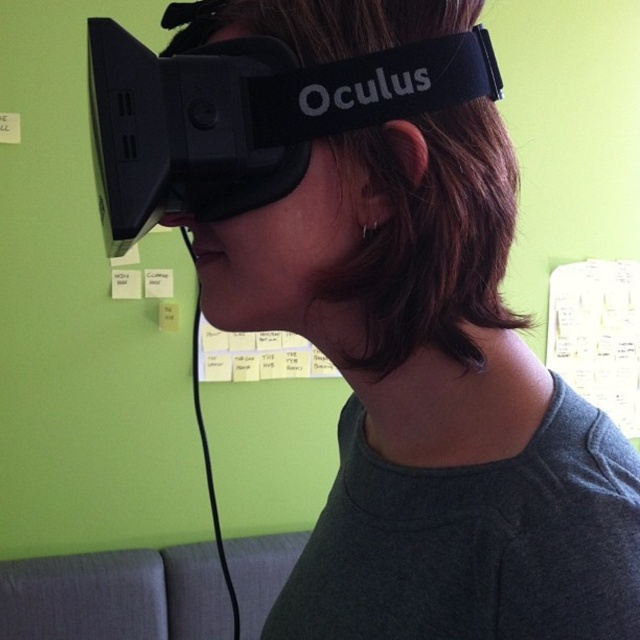
Question: Which point appears farthest from the camera in this image?

Choices:
 (A) (582, 266)
 (B) (269, 84)

Answer: (A)

Question: Does black matte vr goggles at center lie behind white paper notes at upper center?

Choices:
 (A) yes
 (B) no

Answer: (B)

Question: Which point appears farthest from the camera in this image?

Choices:
 (A) tap(625, 358)
 (B) tap(104, 35)

Answer: (A)

Question: Is black matte vr goggles at center positioned before white paper notes at upper center?

Choices:
 (A) no
 (B) yes

Answer: (B)

Question: Can you confirm if black matte vr goggles at center is positioned to the right of white paper notes at upper center?

Choices:
 (A) yes
 (B) no

Answer: (B)